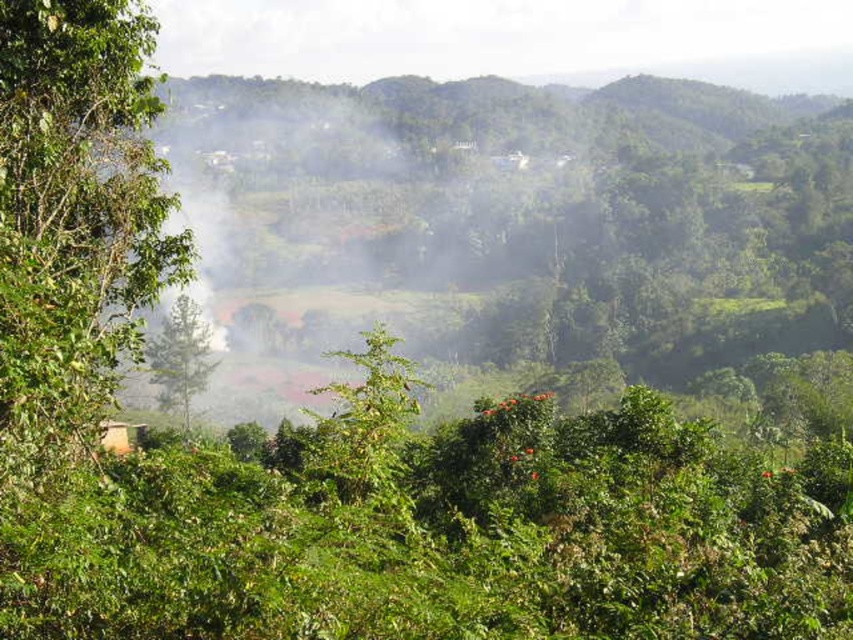
You are a hiker standing in the lush landscape and want to take a photo of the green leafy tree at left and the green matte tree at center. Which tree will appear larger in your photo?

The green leafy tree at left will appear larger in the photo because it is positioned closer to the camera than the green matte tree at center, which is further away.

You are standing at the center of the landscape and want to reach the green leafy tree at left. Which direction should you move in to get there?

The green leafy tree at left is located at point 0.344 on the x and 0.089 on the y coordinates. Since you are at the center, you should move towards the left and slightly forward to reach it.